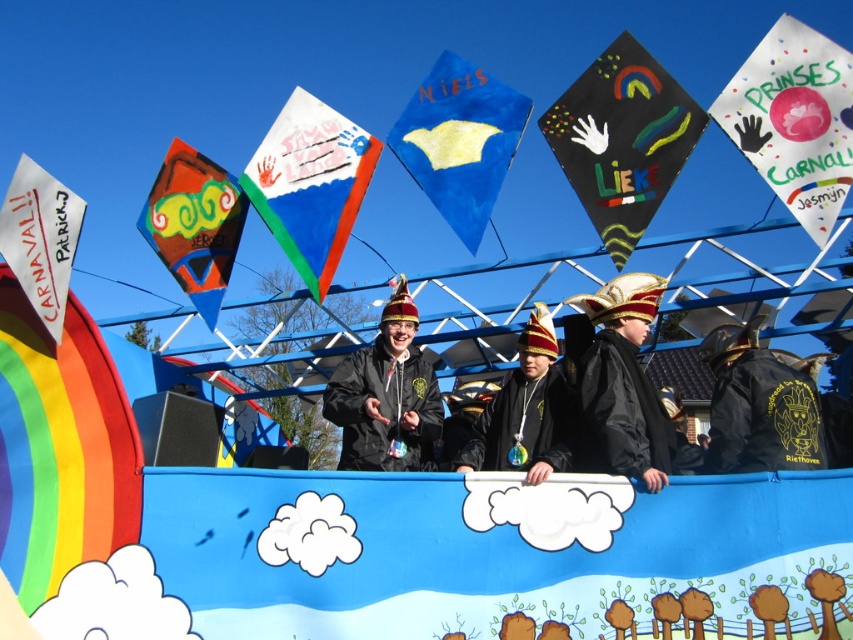
Question: Which object is farther from the camera taking this photo?

Choices:
 (A) white paper flag at left
 (B) black leather jackets at center

Answer: (A)

Question: Does blue paper kite at center have a lesser width compared to black velvet hat at center?

Choices:
 (A) no
 (B) yes

Answer: (A)

Question: Which object appears farthest from the camera in this image?

Choices:
 (A) blue paper kite at center
 (B) black leather jackets at center
 (C) matte blue kite at center

Answer: (A)

Question: Which object is farther from the camera taking this photo?

Choices:
 (A) matte orange kite at upper left
 (B) white paper flag at left
 (C) black matte flag at center
 (D) black leather jackets at center

Answer: (A)

Question: Observing the image, what is the correct spatial positioning of black matte flag at center in reference to black leather jacket at center?

Choices:
 (A) right
 (B) left

Answer: (A)

Question: Can you confirm if black velvet hat at center is positioned to the left of matte orange kite at upper left?

Choices:
 (A) no
 (B) yes

Answer: (A)